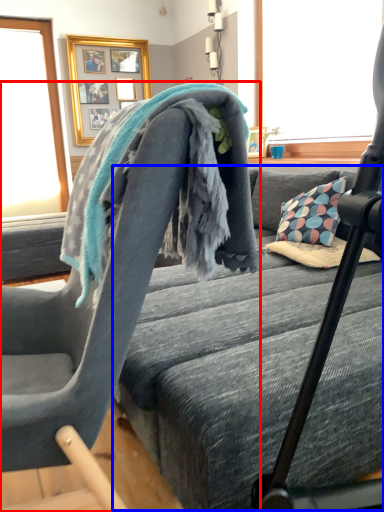
Question: Which object is further to the camera taking this photo, chair (highlighted by a red box) or bed frame (highlighted by a blue box)?

Choices:
 (A) chair
 (B) bed frame

Answer: (B)